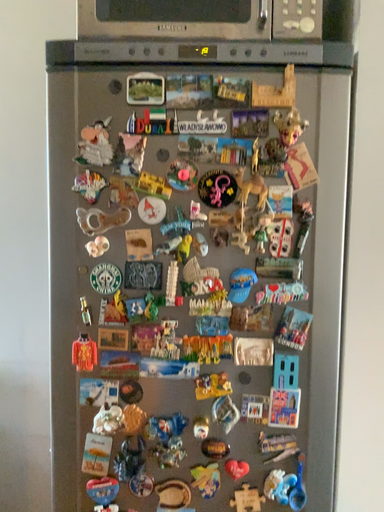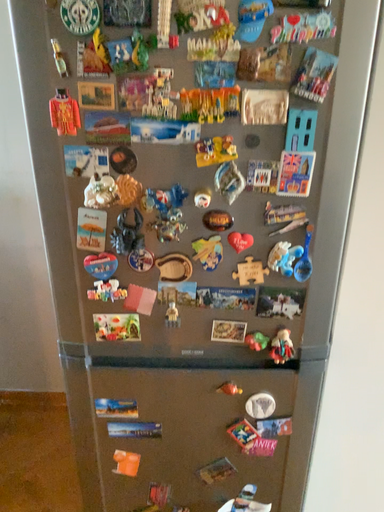
Question: Which way did the camera rotate in the video?

Choices:
 (A) rotated upward
 (B) rotated downward

Answer: (B)